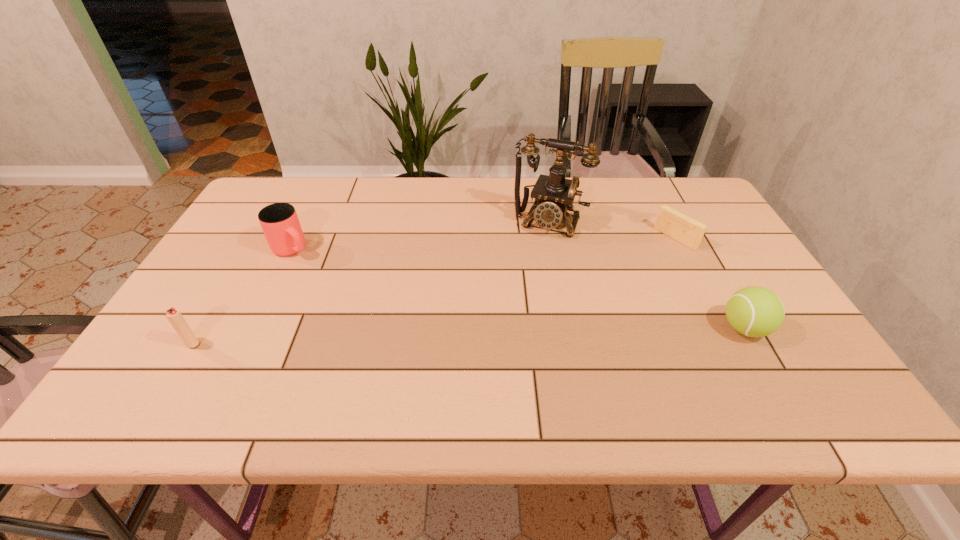
At what (x,y) coordinates should I click in order to perform the action: click on igniter situated at the left edge. Please return your answer as a coordinate pair (x, y). The image size is (960, 540). Looking at the image, I should click on (174, 316).

This screenshot has height=540, width=960. I want to click on cup present at the left edge, so click(279, 221).

I want to click on tennis ball that is at the right edge, so click(x=752, y=311).

Where is `videotape present at the right edge`? videotape present at the right edge is located at coordinates (671, 222).

You are a GUI agent. You are given a task and a screenshot of the screen. Output one action in this format:
    pyautogui.click(x=<x>, y=<y>)
    Task: Click on the object positioned at the near left corner
    Image resolution: width=960 pixels, height=540 pixels.
    Given the screenshot: What is the action you would take?
    pyautogui.click(x=174, y=316)

Locate an element on the screen. The height and width of the screenshot is (540, 960). object present at the near right corner is located at coordinates (x=752, y=311).

Find the location of `free spot at the far edge of the desktop`. free spot at the far edge of the desktop is located at coordinates (403, 199).

The height and width of the screenshot is (540, 960). Identify the location of vacant region at the near edge of the desktop. (287, 357).

Where is `vacant space at the left edge`? The width and height of the screenshot is (960, 540). vacant space at the left edge is located at coordinates point(239,238).

The image size is (960, 540). I want to click on vacant position at the right edge of the desktop, so click(699, 251).